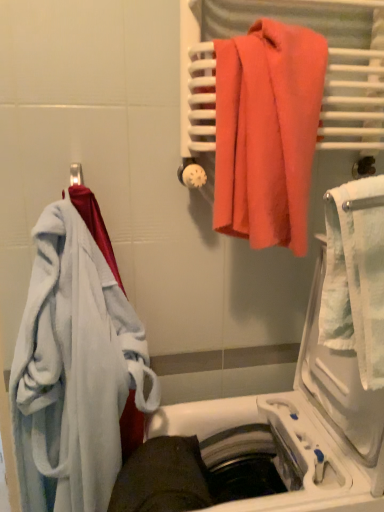
Question: Does coral fabric towel at upper right, which is the first towel from right to left, have a lesser width compared to white textured towel at right?

Choices:
 (A) no
 (B) yes

Answer: (B)

Question: From a real-world perspective, is coral fabric towel at upper right, which is the first towel from right to left, positioned over white textured towel at right based on gravity?

Choices:
 (A) yes
 (B) no

Answer: (A)

Question: Is white textured towel at right surrounded by coral fabric towel at upper right, the second towel positioned from the left?

Choices:
 (A) yes
 (B) no

Answer: (B)

Question: Considering the relative sizes of coral fabric towel at upper right, which is the 2th towel from bottom to top, and white textured towel at right in the image provided, is coral fabric towel at upper right, which is the 2th towel from bottom to top, taller than white textured towel at right?

Choices:
 (A) no
 (B) yes

Answer: (B)

Question: Is coral fabric towel at upper right, the second towel positioned from the left, oriented away from white textured towel at right?

Choices:
 (A) yes
 (B) no

Answer: (B)

Question: From the image's perspective, does coral fabric towel at upper right, which is counted as the first towel, starting from the top, appear higher than white textured towel at right?

Choices:
 (A) yes
 (B) no

Answer: (A)

Question: From a real-world perspective, does soft white bathrobe at left, the 1th towel when ordered from bottom to top, sit lower than white textured towel at right?

Choices:
 (A) no
 (B) yes

Answer: (B)

Question: Considering the relative positions of soft white bathrobe at left, which is counted as the second towel, starting from the top, and white textured towel at right in the image provided, is soft white bathrobe at left, which is counted as the second towel, starting from the top, to the left of white textured towel at right from the viewer's perspective?

Choices:
 (A) no
 (B) yes

Answer: (B)

Question: Could you tell me if soft white bathrobe at left, the second towel from the right, is facing white textured towel at right?

Choices:
 (A) no
 (B) yes

Answer: (A)

Question: Is soft white bathrobe at left, which is counted as the second towel, starting from the top, wider than white textured towel at right?

Choices:
 (A) no
 (B) yes

Answer: (B)

Question: Is the position of soft white bathrobe at left, which is counted as the second towel, starting from the top, more distant than that of white textured towel at right?

Choices:
 (A) yes
 (B) no

Answer: (A)

Question: Is soft white bathrobe at left, which is counted as the first towel, starting from the left, placed right next to white textured towel at right?

Choices:
 (A) no
 (B) yes

Answer: (A)

Question: Does soft white bathrobe at left, which is counted as the first towel, starting from the left, have a larger size compared to coral fabric towel at upper right, which is the first towel from right to left?

Choices:
 (A) no
 (B) yes

Answer: (B)